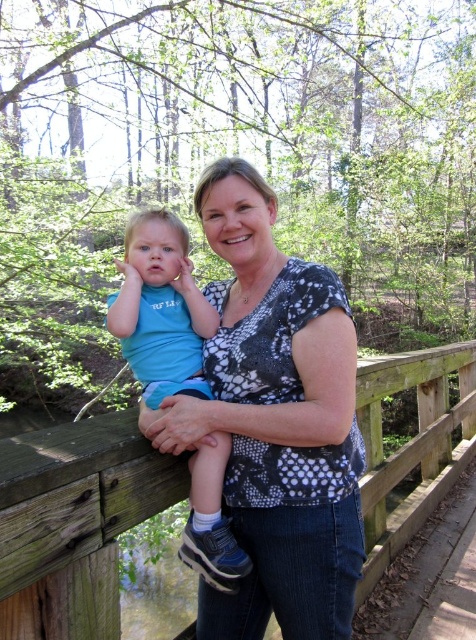
Does wooden bridge at center lie in front of matte blue shirt at left?

No, wooden bridge at center is further to the viewer.

Which is behind, point (69, 577) or point (130, 244)?

The point (130, 244) is behind.

The height and width of the screenshot is (640, 476). Describe the element at coordinates (73, 522) in the screenshot. I see `wooden bridge at center` at that location.

At what (x,y) coordinates should I click in order to perform the action: click on wooden bridge at center. Please return your answer as a coordinate pair (x, y). The image size is (476, 640). Looking at the image, I should click on (73, 522).

Is point (280, 593) farther from viewer compared to point (2, 579)?

Yes, it is behind point (2, 579).

Who is more distant from viewer, (305, 426) or (78, 502)?

The point (305, 426) is more distant.

Find the location of a particular element. The image size is (476, 640). patterned fabric shirt at center is located at coordinates (276, 420).

Is patterned fabric shirt at center bigger than matte blue shirt at left?

Correct, patterned fabric shirt at center is larger in size than matte blue shirt at left.

What do you see at coordinates (276, 420) in the screenshot?
I see `patterned fabric shirt at center` at bounding box center [276, 420].

Locate an element on the screen. patterned fabric shirt at center is located at coordinates (276, 420).